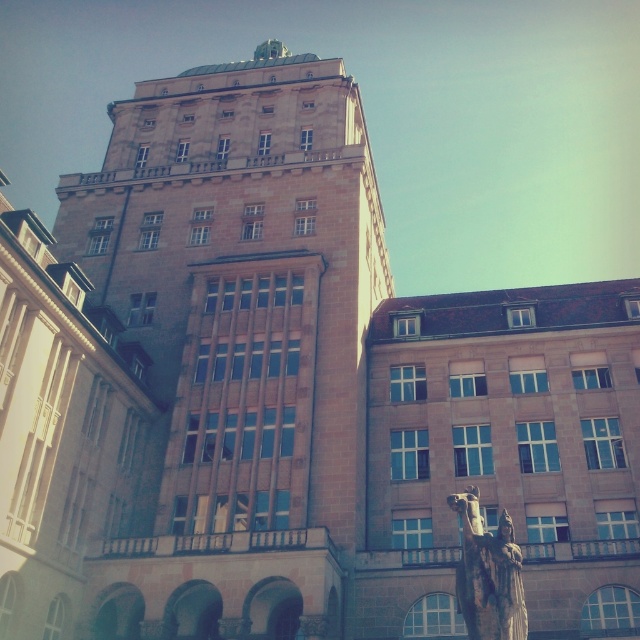
From the picture: You are standing in front of the grand building described in the scene. There is a point marked at coordinates (236, 342). What does this point most likely represent?

The point at coordinates (236, 342) most likely represents the brown stone tower at center, as indicated by the provided description.

You are an architect examining the building. You notice the brown stone tower at center and the bronze statue at center. Which one is positioned higher in the structure?

The brown stone tower at center is located above the bronze statue at center, so it is positioned higher in the structure.